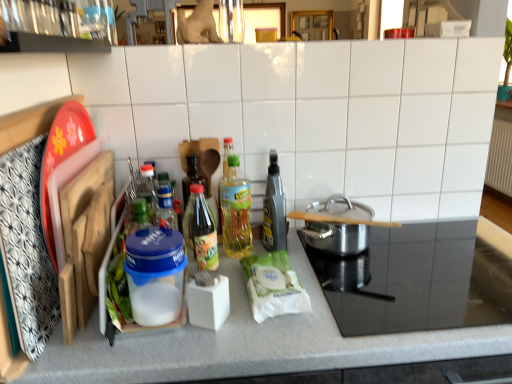
Question: Is stainless steel pot at right, placed as the first appliance when sorted from right to left, bigger or smaller than translucent plastic bottle at center, acting as the second bottle starting from the right?

Choices:
 (A) big
 (B) small

Answer: (A)

Question: Is stainless steel pot at right, placed as the first appliance when sorted from right to left, wider or thinner than translucent plastic bottle at center, the 2th bottle from the left?

Choices:
 (A) thin
 (B) wide

Answer: (B)

Question: Estimate the real-world distances between objects in this image. Which object is farther from the stainless steel pot at right, the second appliance in the left-to-right sequence?

Choices:
 (A) blue plastic container at center-left, the second appliance when ordered from right to left
 (B) translucent plastic bottle at center, the 2th bottle from the left
 (C) white matte countertop at center
 (D) polished stainless steel pot at center right
 (E) green glass bottle at center, the 3th bottle viewed from the right

Answer: (A)

Question: Based on their relative distances, which object is nearer to the translucent plastic bottle at center, acting as the second bottle starting from the right?

Choices:
 (A) white matte paper towel at center
 (B) blue plastic container at center-left, positioned as the first appliance in left-to-right order
 (C) stainless steel pot at right, the second appliance in the left-to-right sequence
 (D) green glass bottle at center, the 3th bottle viewed from the right
 (E) metallic gray spray bottle at center, positioned as the 1th bottle in right-to-left order

Answer: (E)